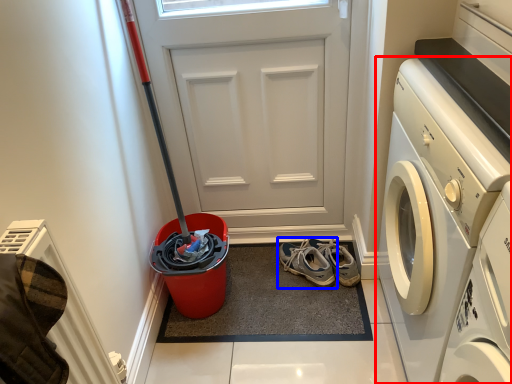
Question: Which point is further to the camera, washing machine (highlighted by a red box) or footwear (highlighted by a blue box)?

Choices:
 (A) washing machine
 (B) footwear

Answer: (B)